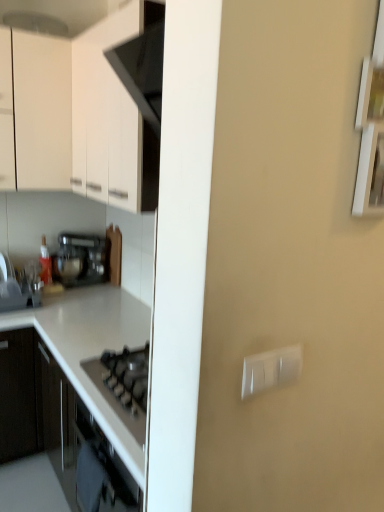
Question: Is the position of white glossy countertop at lower left less distant than that of white matte cabinet at upper left?

Choices:
 (A) no
 (B) yes

Answer: (A)

Question: Are white glossy countertop at lower left and white matte cabinet at upper left located far from each other?

Choices:
 (A) yes
 (B) no

Answer: (B)

Question: Is white glossy countertop at lower left aimed at white matte cabinet at upper left?

Choices:
 (A) yes
 (B) no

Answer: (B)

Question: Is white matte cabinet at upper left a part of white glossy countertop at lower left?

Choices:
 (A) yes
 (B) no

Answer: (B)

Question: Is white glossy countertop at lower left next to white matte cabinet at upper left and touching it?

Choices:
 (A) yes
 (B) no

Answer: (B)

Question: Considering the positions of satin black toaster at left and white plastic switch at right in the image, is satin black toaster at left wider or thinner than white plastic switch at right?

Choices:
 (A) thin
 (B) wide

Answer: (B)

Question: From the image's perspective, is satin black toaster at left located above or below white plastic switch at right?

Choices:
 (A) above
 (B) below

Answer: (A)

Question: In terms of size, does satin black toaster at left appear bigger or smaller than white plastic switch at right?

Choices:
 (A) small
 (B) big

Answer: (B)

Question: Visually, is satin black toaster at left positioned to the left or to the right of white plastic switch at right?

Choices:
 (A) right
 (B) left

Answer: (B)

Question: From the image's perspective, is white matte cabinet at upper left positioned above or below white glossy countertop at lower left?

Choices:
 (A) above
 (B) below

Answer: (A)

Question: Considering their positions, is white matte cabinet at upper left located in front of or behind white glossy countertop at lower left?

Choices:
 (A) behind
 (B) front

Answer: (B)

Question: Is white matte cabinet at upper left taller or shorter than white glossy countertop at lower left?

Choices:
 (A) short
 (B) tall

Answer: (A)

Question: Do you think white matte cabinet at upper left is within white glossy countertop at lower left, or outside of it?

Choices:
 (A) outside
 (B) inside

Answer: (A)

Question: Looking at the image, does white plastic switch at right seem bigger or smaller compared to satin black toaster at left?

Choices:
 (A) small
 (B) big

Answer: (A)

Question: Is point (263, 358) closer or farther from the camera than point (54, 270)?

Choices:
 (A) farther
 (B) closer

Answer: (B)